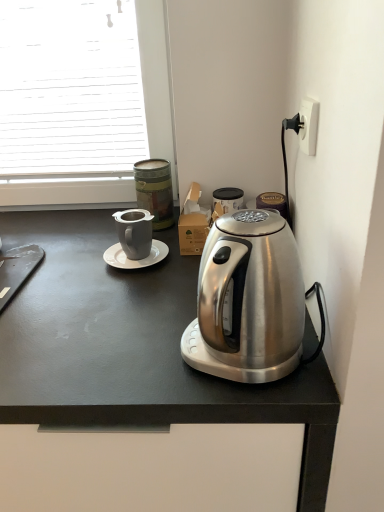
At what (x,y) coordinates should I click in order to perform the action: click on blank space to the left of white glossy saucer at center. Please return your answer as a coordinate pair (x, y). Looking at the image, I should click on (66, 265).